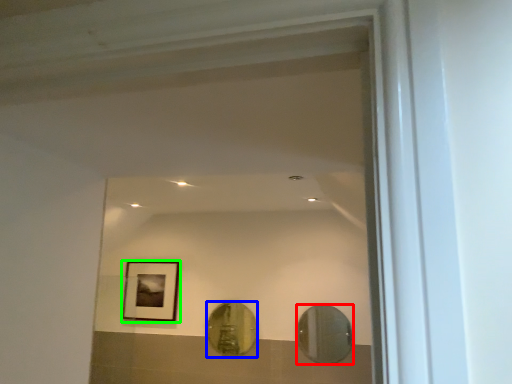
Question: Estimate the real-world distances between objects in this image. Which object is closer to mirror (highlighted by a red box), mirror (highlighted by a blue box) or picture frame (highlighted by a green box)?

Choices:
 (A) mirror
 (B) picture frame

Answer: (A)